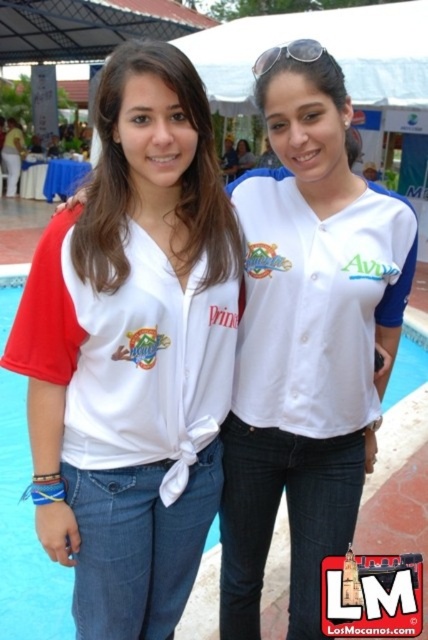
Question: Is white matte jersey at center below white jersey at center?

Choices:
 (A) yes
 (B) no

Answer: (A)

Question: Which object is farther from the camera taking this photo?

Choices:
 (A) blue smooth water at center
 (B) white jersey at center

Answer: (A)

Question: Which of the following is the closest to the observer?

Choices:
 (A) silver metallic sunglasses at upper center
 (B) white jersey at center
 (C) white matte jersey at center

Answer: (C)

Question: Which of these objects is positioned farthest from the blue smooth water at center?

Choices:
 (A) white jersey at center
 (B) white matte jersey at center
 (C) silver metallic sunglasses at upper center

Answer: (C)

Question: From the image, what is the correct spatial relationship of blue smooth water at center in relation to silver metallic sunglasses at upper center?

Choices:
 (A) below
 (B) above

Answer: (A)

Question: Is white matte jersey at center in front of white jersey at center?

Choices:
 (A) yes
 (B) no

Answer: (A)